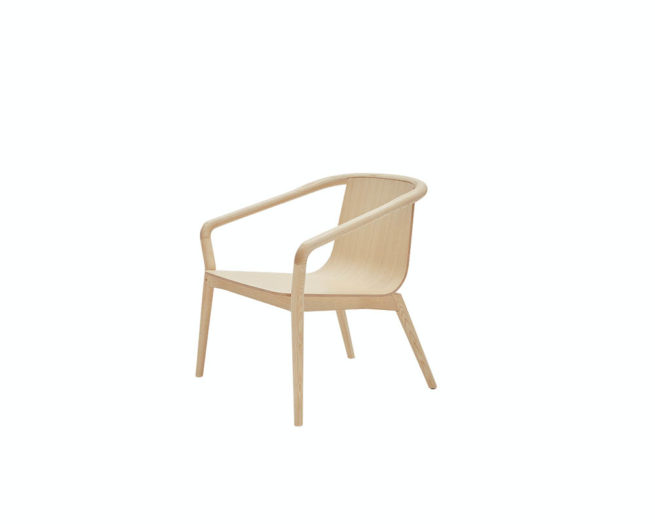
Where is `empty space in front of chair`? This screenshot has height=524, width=655. empty space in front of chair is located at coordinates (126, 323).